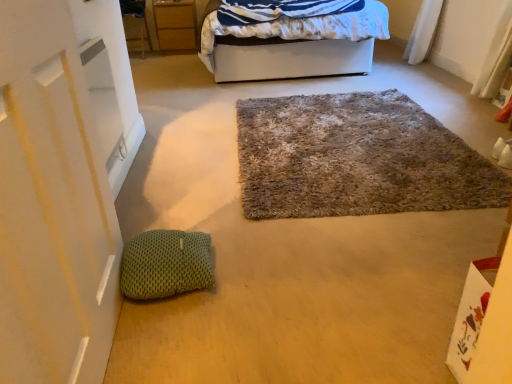
Question: Does white fabric bed at upper center turn towards matte wood cabinet at upper left?

Choices:
 (A) no
 (B) yes

Answer: (A)

Question: Can you confirm if white fabric bed at upper center is wider than matte wood cabinet at upper left?

Choices:
 (A) yes
 (B) no

Answer: (A)

Question: Does white fabric bed at upper center have a greater height compared to matte wood cabinet at upper left?

Choices:
 (A) no
 (B) yes

Answer: (B)

Question: Can you see white fabric bed at upper center touching matte wood cabinet at upper left?

Choices:
 (A) yes
 (B) no

Answer: (B)

Question: Can you confirm if white fabric bed at upper center is bigger than matte wood cabinet at upper left?

Choices:
 (A) no
 (B) yes

Answer: (B)

Question: Considering the relative positions of matte wood cabinet at upper left and white fabric bed at upper center in the image provided, is matte wood cabinet at upper left to the left or to the right of white fabric bed at upper center?

Choices:
 (A) left
 (B) right

Answer: (A)

Question: Is point [x=164, y=29] positioned closer to the camera than point [x=274, y=54]?

Choices:
 (A) closer
 (B) farther

Answer: (B)

Question: Considering their positions, is matte wood cabinet at upper left located in front of or behind white fabric bed at upper center?

Choices:
 (A) front
 (B) behind

Answer: (B)

Question: From the image's perspective, relative to white fabric bed at upper center, is matte wood cabinet at upper left above or below?

Choices:
 (A) above
 (B) below

Answer: (A)

Question: Is white fabric bed at upper center situated inside fuzzy carpet at center or outside?

Choices:
 (A) inside
 (B) outside

Answer: (B)

Question: In the image, is white fabric bed at upper center positioned in front of or behind fuzzy carpet at center?

Choices:
 (A) behind
 (B) front

Answer: (A)

Question: Considering the positions of white fabric bed at upper center and fuzzy carpet at center in the image, is white fabric bed at upper center bigger or smaller than fuzzy carpet at center?

Choices:
 (A) small
 (B) big

Answer: (B)

Question: Does point (275, 29) appear closer or farther from the camera than point (392, 198)?

Choices:
 (A) farther
 (B) closer

Answer: (A)

Question: From the image's perspective, is green knitted pillow at lower left positioned above or below white fabric bed at upper center?

Choices:
 (A) above
 (B) below

Answer: (B)

Question: Is green knitted pillow at lower left wider or thinner than white fabric bed at upper center?

Choices:
 (A) thin
 (B) wide

Answer: (A)